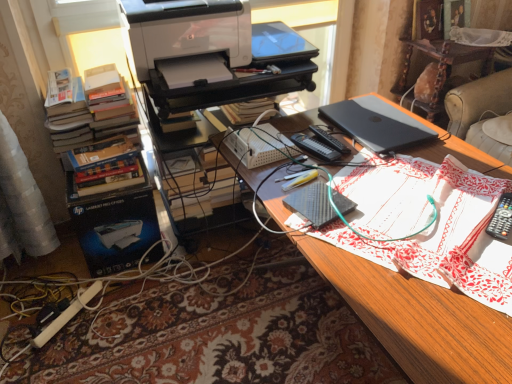
In order to click on vacant region to the left of black plastic remote control at right in this screenshot , I will do `click(438, 224)`.